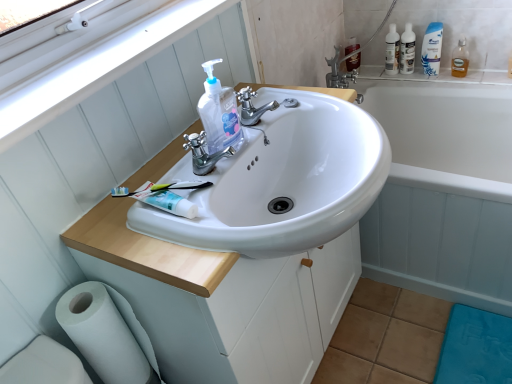
I want to click on vacant space situated on the left part of clear plastic bottles at upper right, the 1th mouthwash in the left-to-right sequence, so click(380, 71).